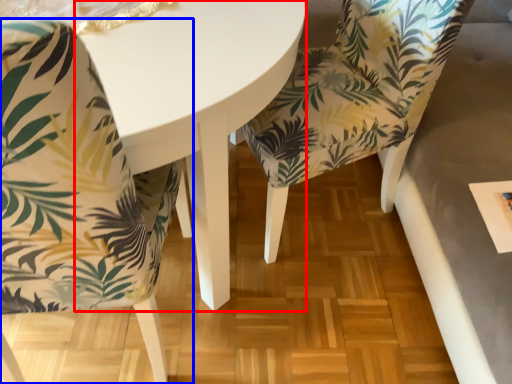
Question: Among these objects, which one is farthest to the camera, round table (highlighted by a red box) or chair (highlighted by a blue box)?

Choices:
 (A) round table
 (B) chair

Answer: (A)